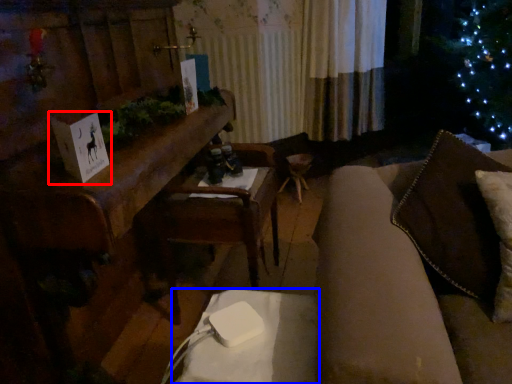
Question: Which object appears closest to the camera in this image, christmas card (highlighted by a red box) or table (highlighted by a blue box)?

Choices:
 (A) christmas card
 (B) table

Answer: (B)